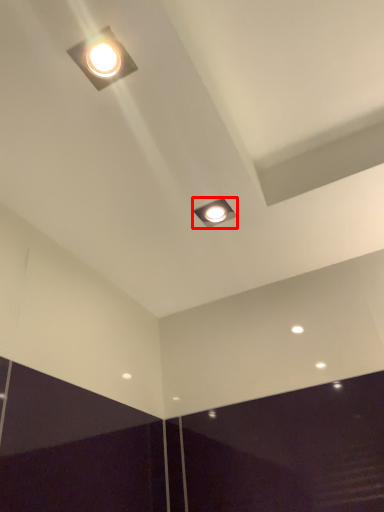
Question: From the image, what is the correct spatial relationship of lamp (annotated by the red box) in relation to lamp?

Choices:
 (A) left
 (B) right

Answer: (B)